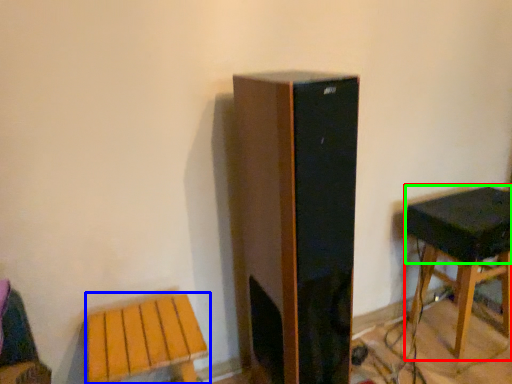
Question: Considering the real-world distances, which object is closest to stool (highlighted by a red box)? stool (highlighted by a blue box) or speaker (highlighted by a green box).

Choices:
 (A) stool
 (B) speaker

Answer: (B)